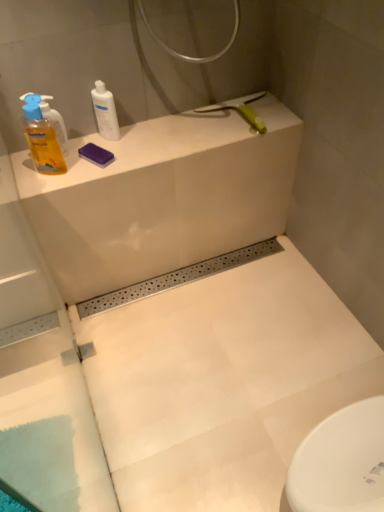
Question: Is white glossy bottle at upper left, which is counted as the 1th cleaning product, starting from the right, not inside yellow translucent liquid at left, which is the 1th cleaning product in left-to-right order?

Choices:
 (A) no
 (B) yes

Answer: (B)

Question: Is white glossy bottle at upper left, which is counted as the 1th cleaning product, starting from the right, bigger than yellow translucent liquid at left, the 2th cleaning product from the right?

Choices:
 (A) no
 (B) yes

Answer: (A)

Question: Is white glossy bottle at upper left, arranged as the 2th cleaning product when viewed from the left, taller than yellow translucent liquid at left, the 2th cleaning product from the right?

Choices:
 (A) no
 (B) yes

Answer: (A)

Question: Is white glossy bottle at upper left, which is counted as the 1th cleaning product, starting from the right, positioned behind yellow translucent liquid at left, which is the 1th cleaning product in left-to-right order?

Choices:
 (A) no
 (B) yes

Answer: (B)

Question: Is white glossy bottle at upper left, which is counted as the 1th cleaning product, starting from the right, shorter than yellow translucent liquid at left, the 2th cleaning product from the right?

Choices:
 (A) no
 (B) yes

Answer: (B)

Question: In the image, is white glossy bottle at upper left, which is counted as the 1th cleaning product, starting from the right, positioned in front of or behind yellow translucent liquid at left, which is the 1th cleaning product in left-to-right order?

Choices:
 (A) behind
 (B) front

Answer: (A)

Question: From the image's perspective, is white glossy bottle at upper left, which is counted as the 1th cleaning product, starting from the right, positioned above or below yellow translucent liquid at left, which is the 1th cleaning product in left-to-right order?

Choices:
 (A) below
 (B) above

Answer: (B)

Question: Looking at their shapes, would you say white glossy bottle at upper left, which is counted as the 1th cleaning product, starting from the right, is wider or thinner than yellow translucent liquid at left, which is the 1th cleaning product in left-to-right order?

Choices:
 (A) wide
 (B) thin

Answer: (B)

Question: Based on their sizes in the image, would you say white glossy bottle at upper left, which is counted as the 1th cleaning product, starting from the right, is bigger or smaller than yellow translucent liquid at left, the 2th cleaning product from the right?

Choices:
 (A) big
 (B) small

Answer: (B)

Question: In terms of height, does yellow translucent liquid at left, the 2th cleaning product from the right, look taller or shorter compared to white glossy bottle at upper left, which is counted as the 1th cleaning product, starting from the right?

Choices:
 (A) short
 (B) tall

Answer: (B)

Question: Is point (61, 138) positioned closer to the camera than point (102, 101)?

Choices:
 (A) closer
 (B) farther

Answer: (B)

Question: In terms of width, does yellow translucent liquid at left, which is the 1th cleaning product in left-to-right order, look wider or thinner when compared to white glossy bottle at upper left, which is counted as the 1th cleaning product, starting from the right?

Choices:
 (A) thin
 (B) wide

Answer: (B)

Question: In terms of size, does yellow translucent liquid at left, the 2th cleaning product from the right, appear bigger or smaller than white glossy bottle at upper left, arranged as the 2th cleaning product when viewed from the left?

Choices:
 (A) big
 (B) small

Answer: (A)

Question: From the image's perspective, is yellow translucent liquid at left, the 2th cleaning product from the right, located above or below white matte counter top at upper left?

Choices:
 (A) below
 (B) above

Answer: (A)

Question: Do you think yellow translucent liquid at left, the 2th cleaning product from the right, is within white matte counter top at upper left, or outside of it?

Choices:
 (A) outside
 (B) inside

Answer: (A)